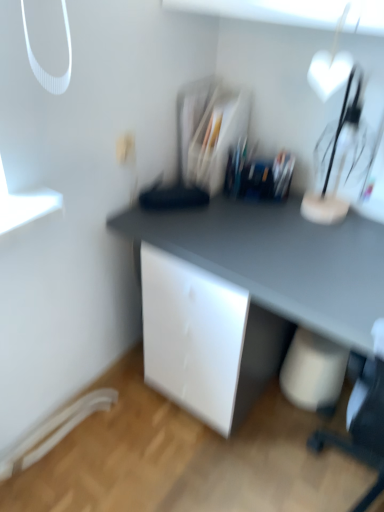
Question: Can we say white matte electric outlet at upper center lies outside white glossy heart-shaped object at upper right?

Choices:
 (A) no
 (B) yes

Answer: (B)

Question: Does white matte electric outlet at upper center have a larger size compared to white glossy heart-shaped object at upper right?

Choices:
 (A) yes
 (B) no

Answer: (B)

Question: From a real-world perspective, does white matte electric outlet at upper center sit lower than white glossy heart-shaped object at upper right?

Choices:
 (A) yes
 (B) no

Answer: (A)

Question: From the image's perspective, is white matte electric outlet at upper center above white glossy heart-shaped object at upper right?

Choices:
 (A) no
 (B) yes

Answer: (A)

Question: Could you tell me if white matte electric outlet at upper center is facing white glossy heart-shaped object at upper right?

Choices:
 (A) no
 (B) yes

Answer: (A)

Question: From the image's perspective, is white matte electric outlet at upper center above or below white glossy heart-shaped object at upper right?

Choices:
 (A) above
 (B) below

Answer: (B)

Question: In the image, is white matte electric outlet at upper center on the left side or the right side of white glossy heart-shaped object at upper right?

Choices:
 (A) right
 (B) left

Answer: (B)

Question: Is white matte electric outlet at upper center taller or shorter than white glossy heart-shaped object at upper right?

Choices:
 (A) tall
 (B) short

Answer: (B)

Question: Is white matte electric outlet at upper center wider or thinner than white glossy heart-shaped object at upper right?

Choices:
 (A) thin
 (B) wide

Answer: (A)

Question: Considering the positions of clear plastic organizer at center and white glossy heart-shaped object at upper right in the image, is clear plastic organizer at center bigger or smaller than white glossy heart-shaped object at upper right?

Choices:
 (A) small
 (B) big

Answer: (B)

Question: From the image's perspective, relative to white glossy heart-shaped object at upper right, is clear plastic organizer at center above or below?

Choices:
 (A) above
 (B) below

Answer: (A)

Question: Do you think clear plastic organizer at center is within white glossy heart-shaped object at upper right, or outside of it?

Choices:
 (A) inside
 (B) outside

Answer: (B)

Question: Considering the positions of point (196, 158) and point (322, 220), is point (196, 158) closer or farther from the camera than point (322, 220)?

Choices:
 (A) closer
 (B) farther

Answer: (B)

Question: From a real-world perspective, is white glossy heart-shaped object at upper right positioned above or below clear plastic organizer at center?

Choices:
 (A) above
 (B) below

Answer: (A)

Question: Relative to clear plastic organizer at center, is white glossy heart-shaped object at upper right in front or behind?

Choices:
 (A) front
 (B) behind

Answer: (A)